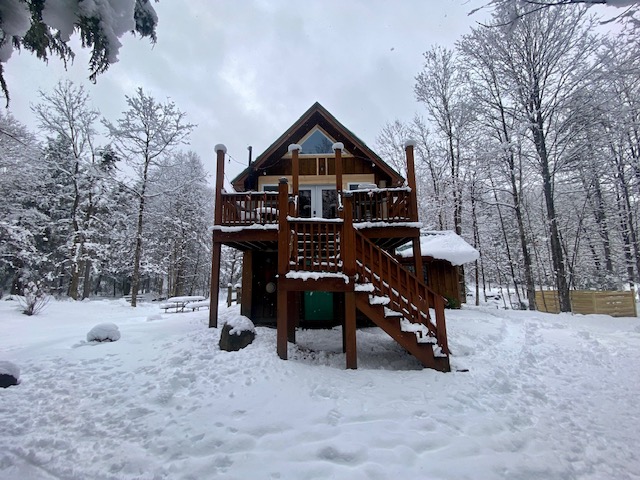
Find the location of `prints`. prints is located at coordinates (342, 457).